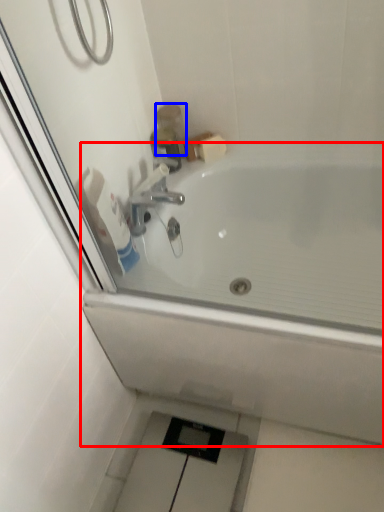
Question: Among these objects, which one is farthest to the camera, bathtub (highlighted by a red box) or toiletry (highlighted by a blue box)?

Choices:
 (A) bathtub
 (B) toiletry

Answer: (B)